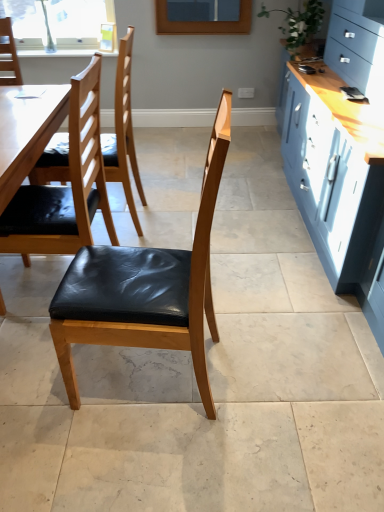
What do you see at coordinates (64, 187) in the screenshot? The height and width of the screenshot is (512, 384). I see `black leather chair at left, the 2th chair viewed from the back` at bounding box center [64, 187].

The height and width of the screenshot is (512, 384). What do you see at coordinates (145, 288) in the screenshot?
I see `matte black leather chair at center, the 1th chair from the front` at bounding box center [145, 288].

In order to click on green leafy plant at upper right in this screenshot , I will do `click(298, 24)`.

Is green leafy plant at upper right at the left side of black leather chair at left, the first chair from the back?

Incorrect, green leafy plant at upper right is not on the left side of black leather chair at left, the first chair from the back.

Find the location of `the 1st chair in front of the green leafy plant at upper right, starting your count from the anchor`. the 1st chair in front of the green leafy plant at upper right, starting your count from the anchor is located at coordinates (123, 133).

How distant is green leafy plant at upper right from black leather chair at left, positioned as the 3th chair in front-to-back order?

They are 5.26 feet apart.

Which point is more forward, (311,36) or (55,143)?

Positioned in front is point (55,143).

Is green leafy plant at upper right not within black leather chair at left, the 2th chair viewed from the back?

Absolutely, green leafy plant at upper right is external to black leather chair at left, the 2th chair viewed from the back.

Based on the photo, considering the relative sizes of green leafy plant at upper right and black leather chair at left, positioned as the second chair in front-to-back order, in the image provided, is green leafy plant at upper right smaller than black leather chair at left, positioned as the second chair in front-to-back order,?

Yes.

From a real-world perspective, is green leafy plant at upper right positioned above or below black leather chair at left, positioned as the second chair in front-to-back order?

green leafy plant at upper right is above black leather chair at left, positioned as the second chair in front-to-back order.

What are the coordinates of `plant below the clear glass window at upper left (from a real-world perspective)` in the screenshot? It's located at (298, 24).

Which of these two, clear glass window at upper left or green leafy plant at upper right, is wider?

green leafy plant at upper right is wider.

Between clear glass window at upper left and green leafy plant at upper right, which one has smaller size?

Smaller between the two is clear glass window at upper left.

Is clear glass window at upper left placed right next to green leafy plant at upper right?

No, clear glass window at upper left is not in contact with green leafy plant at upper right.

What's the angular difference between green leafy plant at upper right and clear glass window at upper left's facing directions?

The angular difference between green leafy plant at upper right and clear glass window at upper left is 94 degrees.

Which object is positioned more to the left, green leafy plant at upper right or clear glass window at upper left?

Positioned to the left is clear glass window at upper left.

From a real-world perspective, is green leafy plant at upper right positioned under clear glass window at upper left based on gravity?

Indeed, from a real-world perspective, green leafy plant at upper right is positioned beneath clear glass window at upper left.

Could clear glass window at upper left be considered to be inside green leafy plant at upper right?

Definitely not — clear glass window at upper left is not inside green leafy plant at upper right.

Can you confirm if matte black leather chair at center, the 1th chair from the front, is thinner than black leather chair at left, positioned as the 3th chair in front-to-back order?

Yes, matte black leather chair at center, the 1th chair from the front, is thinner than black leather chair at left, positioned as the 3th chair in front-to-back order.

Is matte black leather chair at center, positioned as the 3th chair in back-to-front order, aimed at black leather chair at left, positioned as the 3th chair in front-to-back order?

No, matte black leather chair at center, positioned as the 3th chair in back-to-front order, is not facing towards black leather chair at left, positioned as the 3th chair in front-to-back order.

Does point (120, 260) come closer to viewer compared to point (123, 138)?

Yes, point (120, 260) is closer to viewer.

Measure the distance from matte black leather chair at center, positioned as the 3th chair in back-to-front order, to black leather chair at left, positioned as the 3th chair in front-to-back order.

matte black leather chair at center, positioned as the 3th chair in back-to-front order, and black leather chair at left, positioned as the 3th chair in front-to-back order, are 3.69 feet apart.

Between matte black leather chair at center, the 1th chair from the front, and black leather chair at left, positioned as the second chair in front-to-back order, which one has larger width?

black leather chair at left, positioned as the second chair in front-to-back order.

Is matte black leather chair at center, positioned as the 3th chair in back-to-front order, smaller than black leather chair at left, the 2th chair viewed from the back?

Yes, matte black leather chair at center, positioned as the 3th chair in back-to-front order, is smaller than black leather chair at left, the 2th chair viewed from the back.

Are matte black leather chair at center, the 1th chair from the front, and black leather chair at left, the 2th chair viewed from the back, located far from each other?

No.

Between black leather chair at left, the first chair from the back, and matte black leather chair at center, the 1th chair from the front, which one has smaller width?

With smaller width is matte black leather chair at center, the 1th chair from the front.

How much distance is there between black leather chair at left, the first chair from the back, and matte black leather chair at center, positioned as the 3th chair in back-to-front order?

They are 1.13 meters apart.

Which object is positioned more to the left, black leather chair at left, the first chair from the back, or matte black leather chair at center, the 1th chair from the front?

black leather chair at left, the first chair from the back, is more to the left.

Which of these two, black leather chair at left, positioned as the 3th chair in front-to-back order, or matte black leather chair at center, positioned as the 3th chair in back-to-front order, stands taller?

black leather chair at left, positioned as the 3th chair in front-to-back order, is taller.

In the image, there is a black leather chair at left, the first chair from the back. Where is `plant above it (from the image's perspective)`? The width and height of the screenshot is (384, 512). plant above it (from the image's perspective) is located at coordinates (298, 24).

Where is `the 2nd chair in front when counting from the green leafy plant at upper right`? the 2nd chair in front when counting from the green leafy plant at upper right is located at coordinates (64, 187).

Looking at the image, which one is located closer to clear glass window at upper left, black leather chair at left, the first chair from the back, or green leafy plant at upper right?

black leather chair at left, the first chair from the back, is positioned closer to the anchor clear glass window at upper left.

Based on their spatial positions, is clear glass window at upper left or black leather chair at left, positioned as the second chair in front-to-back order, further from black leather chair at left, the first chair from the back?

clear glass window at upper left is further to black leather chair at left, the first chair from the back.

Estimate the real-world distances between objects in this image. Which object is further from black leather chair at left, positioned as the 3th chair in front-to-back order, black leather chair at left, the 2th chair viewed from the back, or matte black leather chair at center, the 1th chair from the front?

matte black leather chair at center, the 1th chair from the front, lies further to black leather chair at left, positioned as the 3th chair in front-to-back order, than the other object.

From the image, which object appears to be farther from black leather chair at left, the first chair from the back, clear glass window at upper left or green leafy plant at upper right?

green leafy plant at upper right.

Estimate the real-world distances between objects in this image. Which object is closer to green leafy plant at upper right, black leather chair at left, positioned as the 3th chair in front-to-back order, or clear glass window at upper left?

black leather chair at left, positioned as the 3th chair in front-to-back order, is positioned closer to the anchor green leafy plant at upper right.

Based on their spatial positions, is matte black leather chair at center, positioned as the 3th chair in back-to-front order, or black leather chair at left, positioned as the second chair in front-to-back order, further from clear glass window at upper left?

matte black leather chair at center, positioned as the 3th chair in back-to-front order.

From the image, which object appears to be nearer to black leather chair at left, the first chair from the back, green leafy plant at upper right or matte black leather chair at center, the 1th chair from the front?

A: matte black leather chair at center, the 1th chair from the front.

Looking at the image, which one is located further to matte black leather chair at center, positioned as the 3th chair in back-to-front order, green leafy plant at upper right or clear glass window at upper left?

clear glass window at upper left lies further to matte black leather chair at center, positioned as the 3th chair in back-to-front order, than the other object.

Where is `plant between matte black leather chair at center, the 1th chair from the front, and clear glass window at upper left, along the z-axis`? plant between matte black leather chair at center, the 1th chair from the front, and clear glass window at upper left, along the z-axis is located at coordinates (298, 24).

Image resolution: width=384 pixels, height=512 pixels. Identify the location of chair between matte black leather chair at center, the 1th chair from the front, and black leather chair at left, the first chair from the back, in the front-back direction. (64, 187).

Identify the location of chair between black leather chair at left, positioned as the second chair in front-to-back order, and clear glass window at upper left in the front-back direction. The image size is (384, 512). (123, 133).